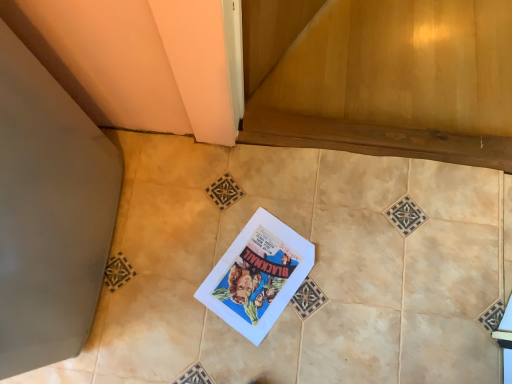
You are a GUI agent. You are given a task and a screenshot of the screen. Output one action in this format:
    pyautogui.click(x=<x>, y=<y>)
    Task: Click on the vacant space to the right of matte paper comic book at center
    
    Given the screenshot: What is the action you would take?
    (x=345, y=284)